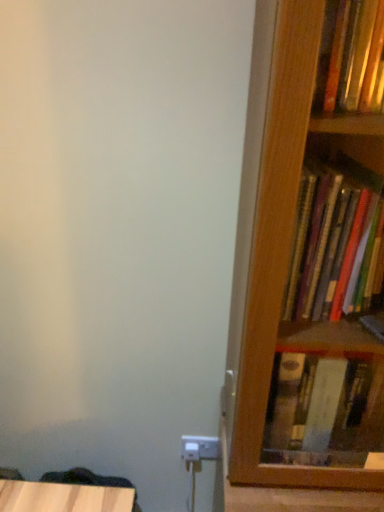
You are a GUI agent. You are given a task and a screenshot of the screen. Output one action in this format:
    pyautogui.click(x=<x>, y=<y>)
    Task: Click on the wooden bookcase at right
    The width and height of the screenshot is (384, 512).
    Given the screenshot: What is the action you would take?
    pyautogui.click(x=276, y=234)

Describe the element at coordinates (276, 234) in the screenshot. This screenshot has width=384, height=512. I see `wooden bookcase at right` at that location.

This screenshot has height=512, width=384. What are the coordinates of `wooden bookcase at right` in the screenshot? It's located at (276, 234).